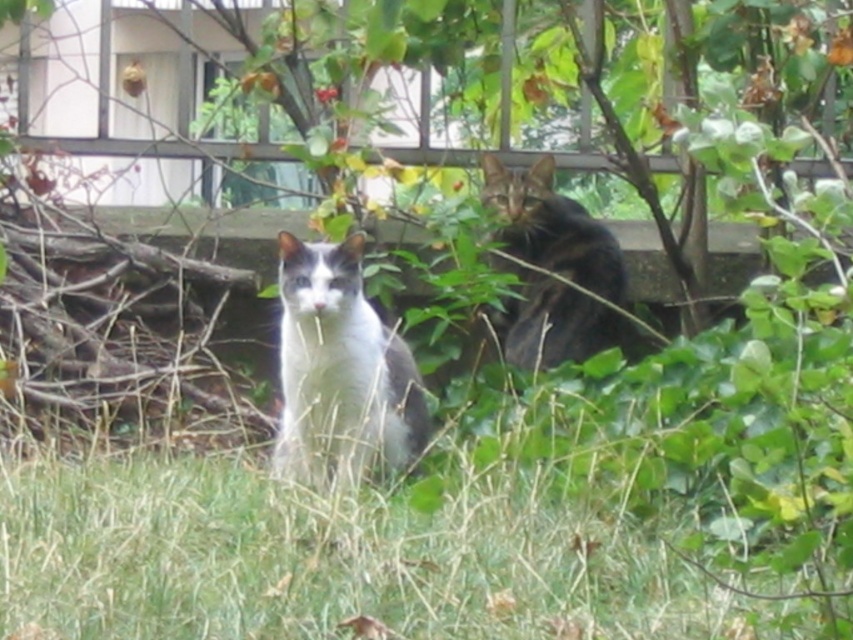
Which is behind, point (369, 403) or point (575, 356)?

Point (575, 356)

Find the location of `white-furred cat at center`. white-furred cat at center is located at coordinates (340, 369).